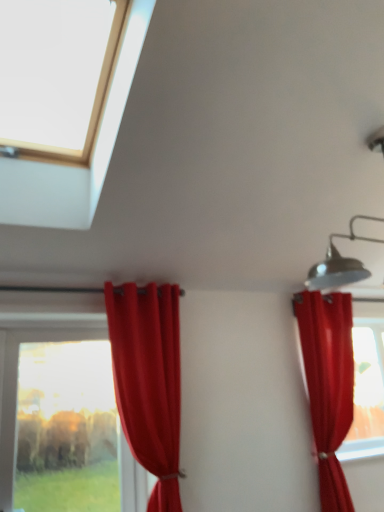
Question: Is transparent glass window at lower left, placed as the first window when sorted from back to front, next to transparent glass window at upper left, the 2th window when ordered from bottom to top?

Choices:
 (A) no
 (B) yes

Answer: (A)

Question: Is transparent glass window at lower left, which is the 2th window from top to bottom, wider than transparent glass window at upper left, which appears as the first window when viewed from the top?

Choices:
 (A) no
 (B) yes

Answer: (A)

Question: Is transparent glass window at lower left, the 1th window from the bottom, far from transparent glass window at upper left, which appears as the first window when viewed from the top?

Choices:
 (A) no
 (B) yes

Answer: (B)

Question: Considering the relative sizes of transparent glass window at lower left, which is the 2th window from top to bottom, and transparent glass window at upper left, which is the 2th window from back to front, in the image provided, is transparent glass window at lower left, which is the 2th window from top to bottom, bigger than transparent glass window at upper left, which is the 2th window from back to front,?

Choices:
 (A) no
 (B) yes

Answer: (A)

Question: Is transparent glass window at lower left, the 1th window from the bottom, not within transparent glass window at upper left, arranged as the 1th window when viewed from the front?

Choices:
 (A) yes
 (B) no

Answer: (A)

Question: Is transparent glass window at lower left, which is the 2th window from top to bottom, behind transparent glass window at upper left, the 2th window when ordered from bottom to top?

Choices:
 (A) no
 (B) yes

Answer: (B)

Question: Is transparent glass window at upper left, which appears as the first window when viewed from the top, shorter than transparent glass window at lower left, the 1th window from the bottom?

Choices:
 (A) yes
 (B) no

Answer: (A)

Question: Considering the relative sizes of transparent glass window at upper left, which appears as the first window when viewed from the top, and transparent glass window at lower left, the 1th window from the bottom, in the image provided, is transparent glass window at upper left, which appears as the first window when viewed from the top, bigger than transparent glass window at lower left, the 1th window from the bottom,?

Choices:
 (A) yes
 (B) no

Answer: (A)

Question: Could you tell me if transparent glass window at upper left, arranged as the 1th window when viewed from the front, is turned towards transparent glass window at lower left, the 1th window from the bottom?

Choices:
 (A) no
 (B) yes

Answer: (A)

Question: Is transparent glass window at upper left, the 2th window when ordered from bottom to top, located outside transparent glass window at lower left, the 1th window from the bottom?

Choices:
 (A) no
 (B) yes

Answer: (B)

Question: Can you confirm if transparent glass window at upper left, which appears as the first window when viewed from the top, is wider than transparent glass window at lower left, marked as the 2th window in a front-to-back arrangement?

Choices:
 (A) yes
 (B) no

Answer: (A)

Question: Considering the relative positions of transparent glass window at upper left, arranged as the 1th window when viewed from the front, and transparent glass window at lower left, placed as the first window when sorted from back to front, in the image provided, is transparent glass window at upper left, arranged as the 1th window when viewed from the front, behind transparent glass window at lower left, placed as the first window when sorted from back to front,?

Choices:
 (A) yes
 (B) no

Answer: (B)

Question: From a real-world perspective, is satin red curtain at right, which appears as the first curtain when viewed from the right, beneath transparent glass window at lower left, marked as the 2th window in a front-to-back arrangement?

Choices:
 (A) no
 (B) yes

Answer: (A)